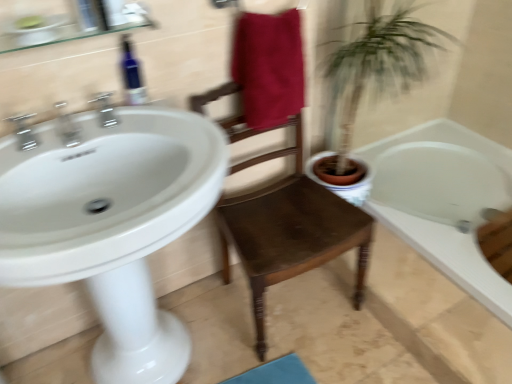
Where is `free space to the left of chrome metallic faucet at upper left, acting as the 2th tap starting from the left`? The width and height of the screenshot is (512, 384). free space to the left of chrome metallic faucet at upper left, acting as the 2th tap starting from the left is located at coordinates (35, 151).